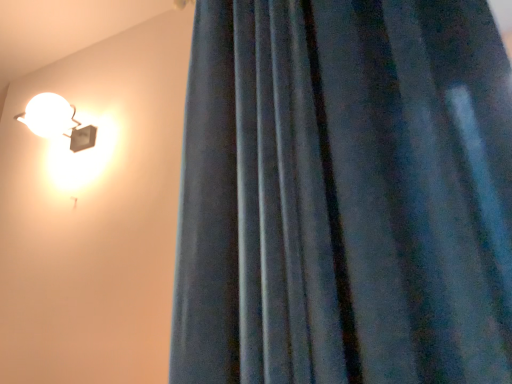
Identify the location of matte white bulb at upper left. click(x=57, y=121).

Image resolution: width=512 pixels, height=384 pixels. Describe the element at coordinates (57, 121) in the screenshot. I see `matte white bulb at upper left` at that location.

This screenshot has height=384, width=512. I want to click on matte white bulb at upper left, so click(57, 121).